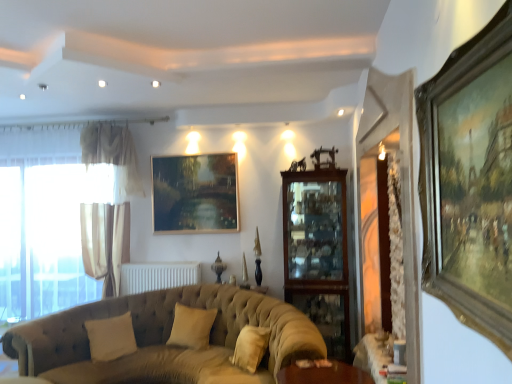
Question: Is tufted fabric couch at lower left in contact with beige fabric pillow at center, which appears as the first pillow when viewed from the right?

Choices:
 (A) no
 (B) yes

Answer: (A)

Question: Does tufted fabric couch at lower left turn towards beige fabric pillow at center, the 2th pillow from the left?

Choices:
 (A) no
 (B) yes

Answer: (B)

Question: Considering the relative sizes of tufted fabric couch at lower left and beige fabric pillow at center, the 2th pillow from the left, in the image provided, is tufted fabric couch at lower left smaller than beige fabric pillow at center, the 2th pillow from the left,?

Choices:
 (A) no
 (B) yes

Answer: (A)

Question: From a real-world perspective, is tufted fabric couch at lower left on top of beige fabric pillow at center, which appears as the first pillow when viewed from the right?

Choices:
 (A) yes
 (B) no

Answer: (B)

Question: Can you confirm if tufted fabric couch at lower left is thinner than beige fabric pillow at center, which appears as the first pillow when viewed from the right?

Choices:
 (A) yes
 (B) no

Answer: (B)

Question: Would you consider tufted fabric couch at lower left to be distant from beige fabric pillow at center, the 2th pillow from the left?

Choices:
 (A) no
 (B) yes

Answer: (A)

Question: Does gold-toned wooden picture frame at right, which ranks as the 2th picture frame in back-to-front order, lie behind white matte radiator at center?

Choices:
 (A) no
 (B) yes

Answer: (A)

Question: Is gold-toned wooden picture frame at right, which appears as the 1th picture frame when viewed from the front, placed right next to white matte radiator at center?

Choices:
 (A) no
 (B) yes

Answer: (A)

Question: Can you confirm if gold-toned wooden picture frame at right, acting as the 1th picture frame starting from the right, is wider than white matte radiator at center?

Choices:
 (A) yes
 (B) no

Answer: (B)

Question: Is gold-toned wooden picture frame at right, which appears as the 1th picture frame when viewed from the front, surrounding white matte radiator at center?

Choices:
 (A) no
 (B) yes

Answer: (A)

Question: Is the position of gold-toned wooden picture frame at right, the 2th picture frame from the left, less distant than that of white matte radiator at center?

Choices:
 (A) no
 (B) yes

Answer: (B)

Question: Can you confirm if gold-toned wooden picture frame at right, which ranks as the 2th picture frame in back-to-front order, is bigger than white matte radiator at center?

Choices:
 (A) yes
 (B) no

Answer: (B)

Question: Can you confirm if beige fabric pillow at center, which appears as the first pillow when viewed from the right, is taller than beige fabric pillow at lower left, which appears as the 1th pillow when viewed from the left?

Choices:
 (A) no
 (B) yes

Answer: (A)